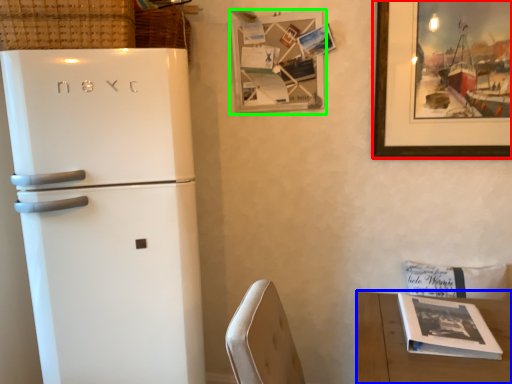
Question: Estimate the real-world distances between objects in this image. Which object is farther from picture frame (highlighted by a red box), table (highlighted by a blue box) or picture frame (highlighted by a green box)?

Choices:
 (A) table
 (B) picture frame

Answer: (A)